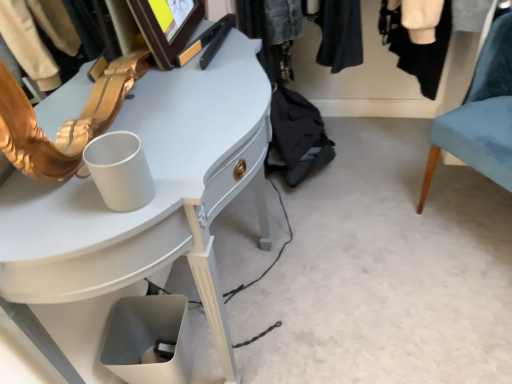
You are a GUI agent. You are given a task and a screenshot of the screen. Output one action in this format:
    pyautogui.click(x=<x>, y=<y>)
    Task: Click on the empty space that is ontop of white glossy desk at upper left (from a real-world perspective)
    The height and width of the screenshot is (384, 512).
    Given the screenshot: What is the action you would take?
    pyautogui.click(x=172, y=102)